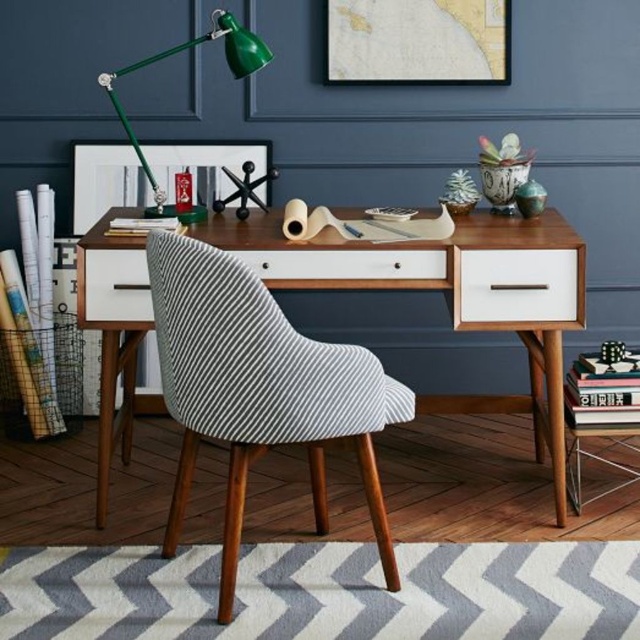
Between map paper at upper center and white matte drawer at right, which one is positioned lower?

Positioned lower is white matte drawer at right.

Who is positioned more to the right, map paper at upper center or white matte drawer at right?

Positioned to the right is white matte drawer at right.

Is point (394, 52) positioned behind point (564, 260)?

Yes, it is.

Image resolution: width=640 pixels, height=640 pixels. In order to click on map paper at upper center in this screenshot , I will do coord(417,40).

Who is positioned more to the right, wooden computer desk at center or white matte drawer at left?

Positioned to the right is wooden computer desk at center.

Can you confirm if wooden computer desk at center is taller than white matte drawer at left?

Yes.

What do you see at coordinates (472, 301) in the screenshot? I see `wooden computer desk at center` at bounding box center [472, 301].

Where is `wooden computer desk at center`? This screenshot has width=640, height=640. wooden computer desk at center is located at coordinates (472, 301).

Can you confirm if wooden computer desk at center is positioned to the left of matte black picture frame at upper center?

Incorrect, wooden computer desk at center is not on the left side of matte black picture frame at upper center.

Does point (436, 397) lie in front of point (180, 163)?

Yes, it is.

Find the location of `wooden computer desk at center`. wooden computer desk at center is located at coordinates (472, 301).